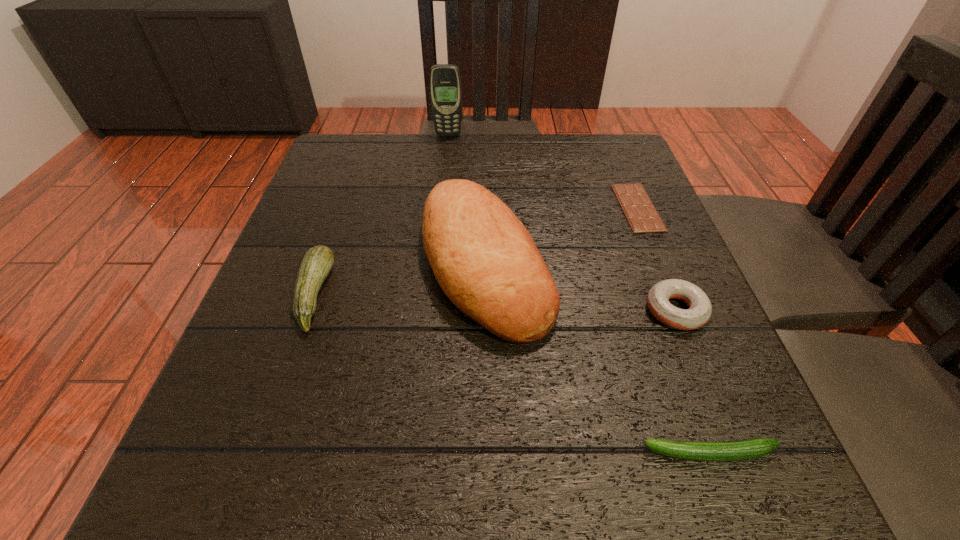
You are a GUI agent. You are given a task and a screenshot of the screen. Output one action in this format:
    pyautogui.click(x=<x>, y=<y>)
    Task: Click on the tallest object
    
    Given the screenshot: What is the action you would take?
    pyautogui.click(x=445, y=83)

This screenshot has width=960, height=540. Find the location of `cellular telephone`. cellular telephone is located at coordinates (445, 83).

At what (x,y) coordinates should I click in order to perform the action: click on bread. Please return your answer as a coordinate pair (x, y). Looking at the image, I should click on (484, 259).

Identify the location of the left zucchini. The image size is (960, 540). click(318, 261).

At what (x,y) coordinates should I click in order to perform the action: click on the leftmost object. Please return your answer as a coordinate pair (x, y). The width and height of the screenshot is (960, 540). Looking at the image, I should click on (318, 261).

Identify the location of the fourth tallest object. This screenshot has height=540, width=960. (700, 308).

The image size is (960, 540). What are the coordinates of `the right zucchini` in the screenshot? It's located at (752, 448).

Where is `the nearer zucchini`? The image size is (960, 540). the nearer zucchini is located at coordinates (752, 448).

At what (x,y) coordinates should I click in order to perform the action: click on the shortest object. Please return your answer as a coordinate pair (x, y). Looking at the image, I should click on [x=642, y=216].

Where is `vacant space located 0.300m on the screen of the cellular telephone`? This screenshot has width=960, height=540. vacant space located 0.300m on the screen of the cellular telephone is located at coordinates (442, 206).